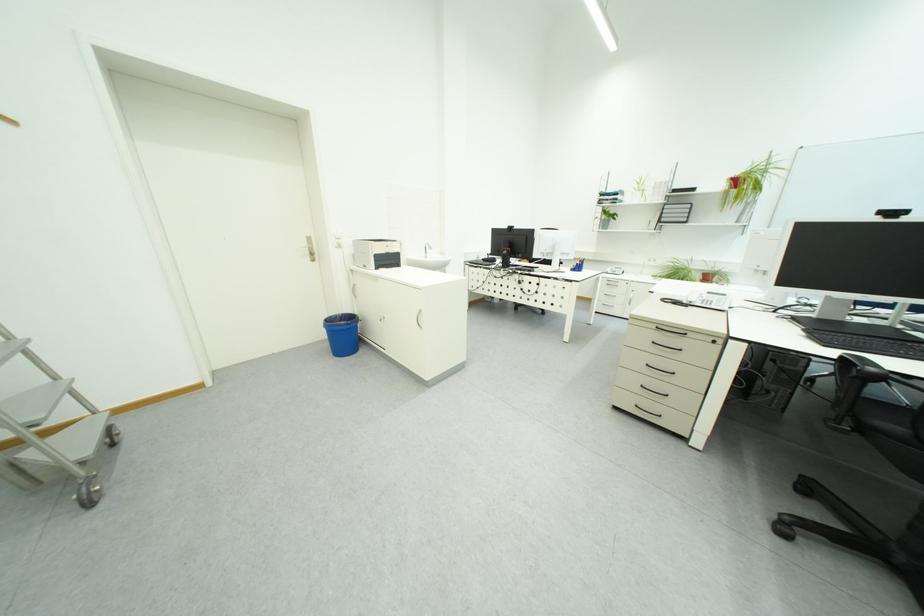
What do you see at coordinates (665, 346) in the screenshot? Image resolution: width=924 pixels, height=616 pixels. I see `the black drawer handle` at bounding box center [665, 346].